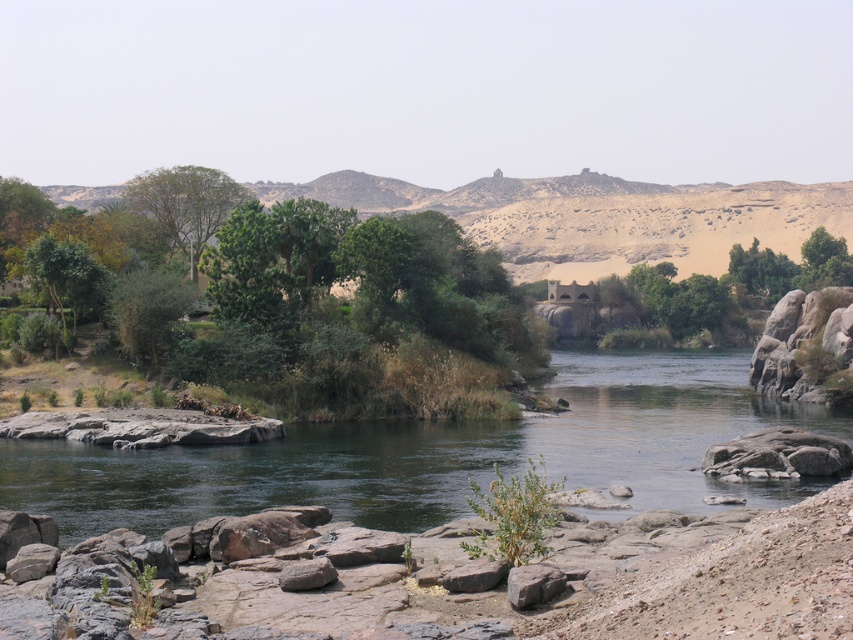
Question: Which of the following is the farthest from the observer?

Choices:
 (A) greenish-brown rock at center
 (B) rusty metallic rock at lower center

Answer: (A)

Question: Which is nearer to the greenish-brown rock at center?

Choices:
 (A) rusty metallic rock at lower center
 (B) gray rough rock at center

Answer: (B)

Question: Which is farther from the green leafy tree at upper center?

Choices:
 (A) green leafy tree at left
 (B) greenish-brown rock at center
 (C) rusty metallic rock at lower center
 (D) gray rough rock at center

Answer: (C)

Question: Can you confirm if green leafy tree at upper center is positioned to the right of gray rough rock at center?

Choices:
 (A) yes
 (B) no

Answer: (B)

Question: Is the position of green leafy tree at upper center more distant than that of rusty metallic rock at lower center?

Choices:
 (A) yes
 (B) no

Answer: (A)

Question: Can you confirm if greenish-brown rock at center is wider than green leafy tree at upper center?

Choices:
 (A) yes
 (B) no

Answer: (A)